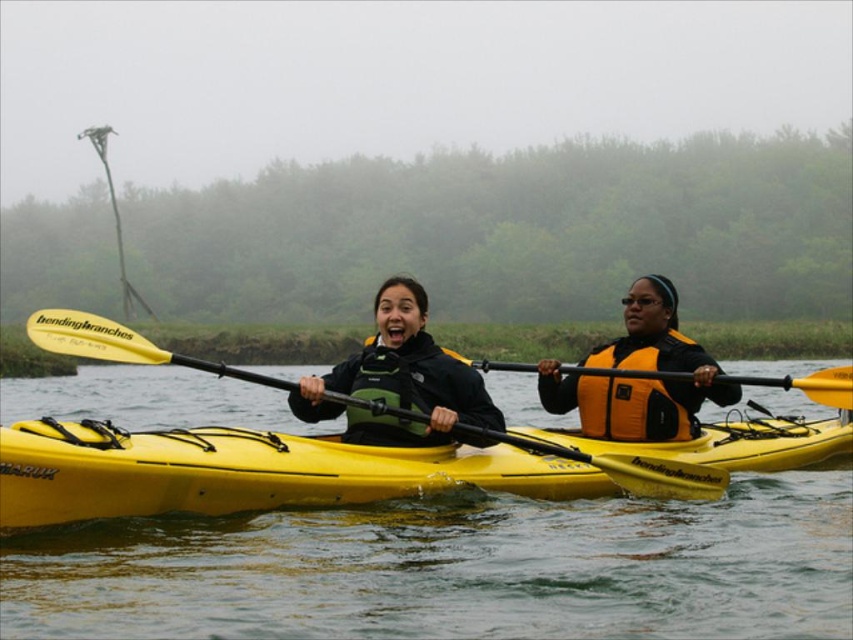
Looking at this image, you are a safety inspector reviewing the image of the kayakers. You notice a point at coordinates (631, 396). What object is located at this point?

The point at coordinates (631, 396) corresponds to the orange and yellow fabric life jacket at right.

You are a photographer trying to capture the kayakers in the bright yellow kayak. You notice the green fabric life jacket at center and the yellow matte paddle at center. Which object is covering part of the other?

The green fabric life jacket at center is positioned over the yellow matte paddle at center, so it is covering part of it.